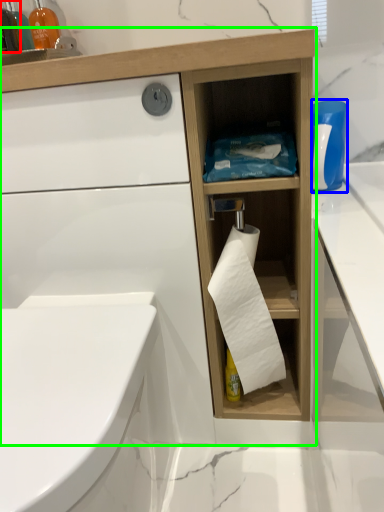
Question: Which object is the closest to the bottle (highlighted by a red box)? Choose among these: cleaning product (highlighted by a blue box) or bathroom cabinet (highlighted by a green box).

Choices:
 (A) cleaning product
 (B) bathroom cabinet

Answer: (B)